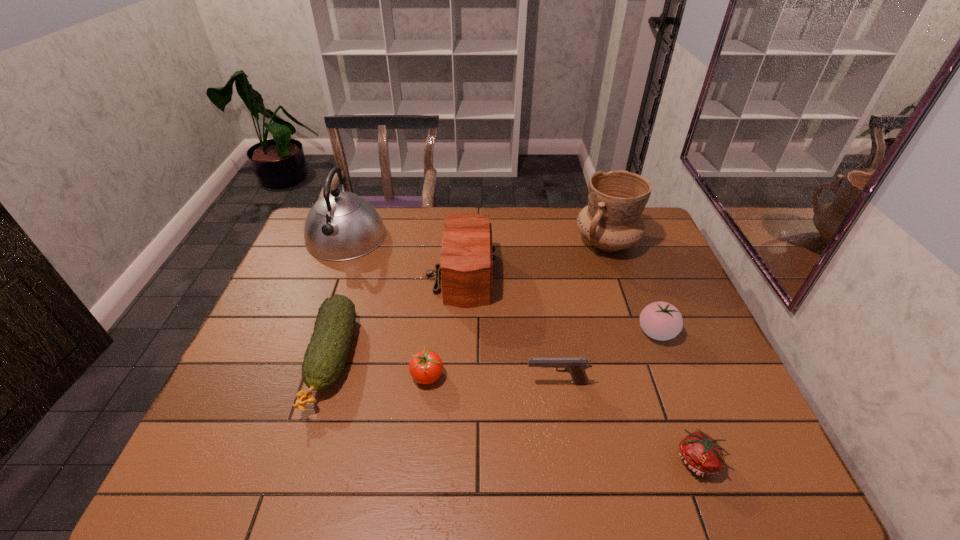
Locate an element on the screen. This screenshot has width=960, height=540. vacant region located on the front-facing side of the radio receiver is located at coordinates (565, 276).

Where is `free space located 0.060m on the back of the tallest tomato`? This screenshot has height=540, width=960. free space located 0.060m on the back of the tallest tomato is located at coordinates (645, 302).

The image size is (960, 540). What are the coordinates of `blank space located 0.100m at the blossom end of the cucumber` in the screenshot? It's located at (300, 463).

Locate an element on the screen. This screenshot has width=960, height=540. free space located 0.260m at the barrel of the pistol is located at coordinates (420, 383).

Identify the location of vacant space located at the barrel of the pistol. The width and height of the screenshot is (960, 540). (473, 383).

Identify the location of vacant space situated at the barrel of the pistol. This screenshot has width=960, height=540. (433, 383).

The image size is (960, 540). I want to click on vacant space located on the left of the second farthest tomato, so click(x=254, y=376).

This screenshot has width=960, height=540. Find the location of `free space located 0.380m on the back of the nearest object`. free space located 0.380m on the back of the nearest object is located at coordinates click(643, 315).

In order to click on kettle located at the far edge in this screenshot , I will do `click(340, 226)`.

Where is `pottery situated at the far edge`? This screenshot has height=540, width=960. pottery situated at the far edge is located at coordinates (612, 221).